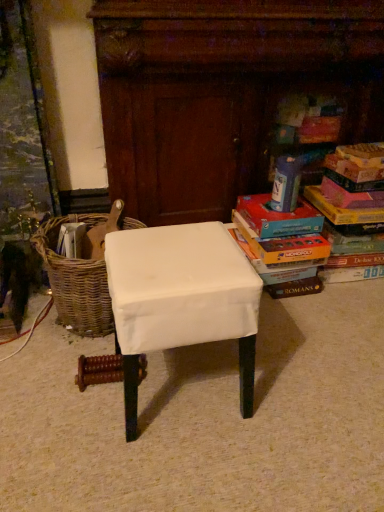
Where is `vacant space positioned to the left of white fabric-covered stool at center`? The image size is (384, 512). vacant space positioned to the left of white fabric-covered stool at center is located at coordinates (54, 402).